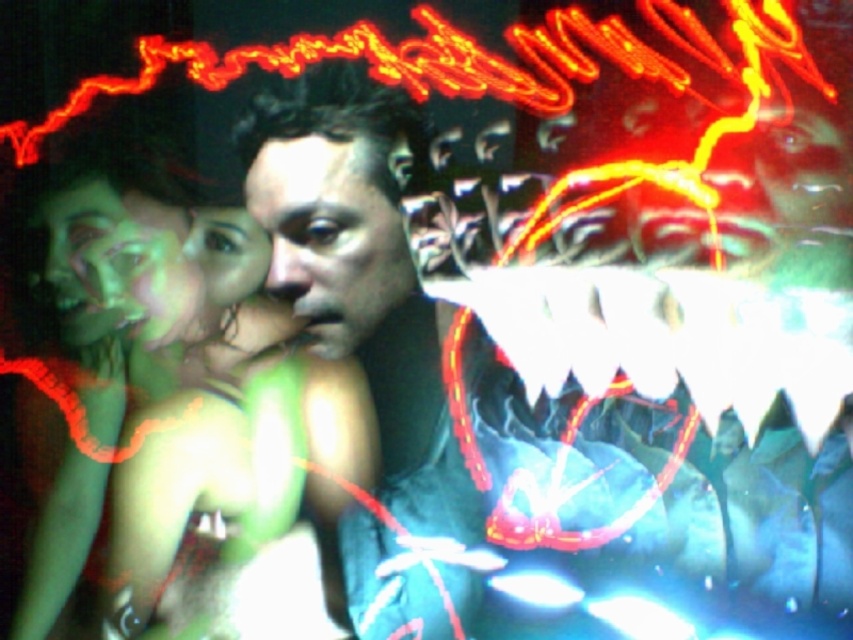
Question: From the image, what is the correct spatial relationship of green matte skin at center in relation to smooth green skin at center?

Choices:
 (A) below
 (B) above

Answer: (A)

Question: Can you confirm if green matte face at upper left is positioned below shiny plastic face at upper right?

Choices:
 (A) no
 (B) yes

Answer: (B)

Question: Which object is positioned closest to the smooth green skin at center?

Choices:
 (A) blue fabric at center
 (B) smooth skin face at center
 (C) shiny plastic face at upper right

Answer: (B)

Question: Which point is closer to the camera?

Choices:
 (A) shiny plastic face at upper right
 (B) smooth green skin at center

Answer: (A)

Question: Can you confirm if blue fabric at center is positioned above shiny plastic face at upper right?

Choices:
 (A) yes
 (B) no

Answer: (B)

Question: Which of these objects is positioned farthest from the blue fabric at center?

Choices:
 (A) green matte face at upper left
 (B) green matte skin at center
 (C) shiny plastic face at upper right

Answer: (A)